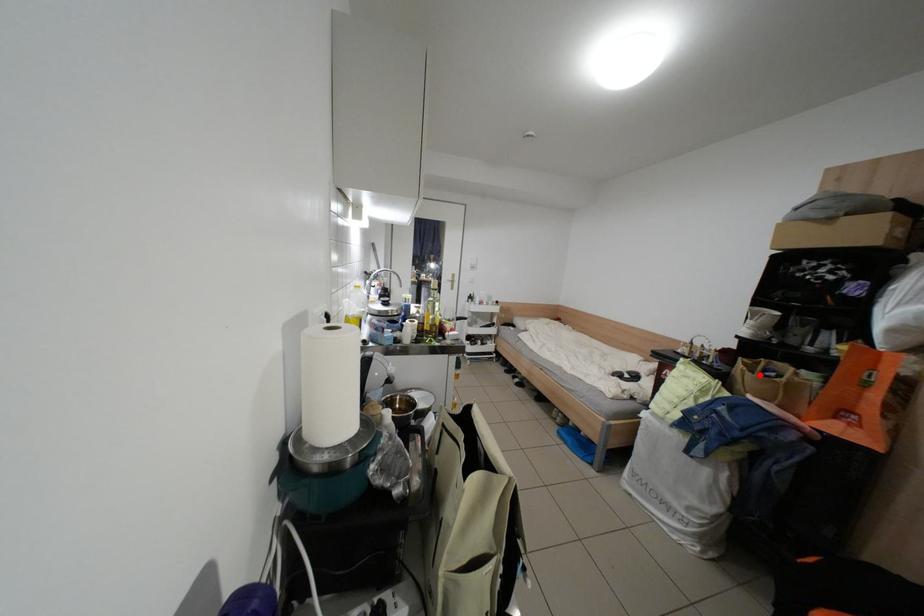
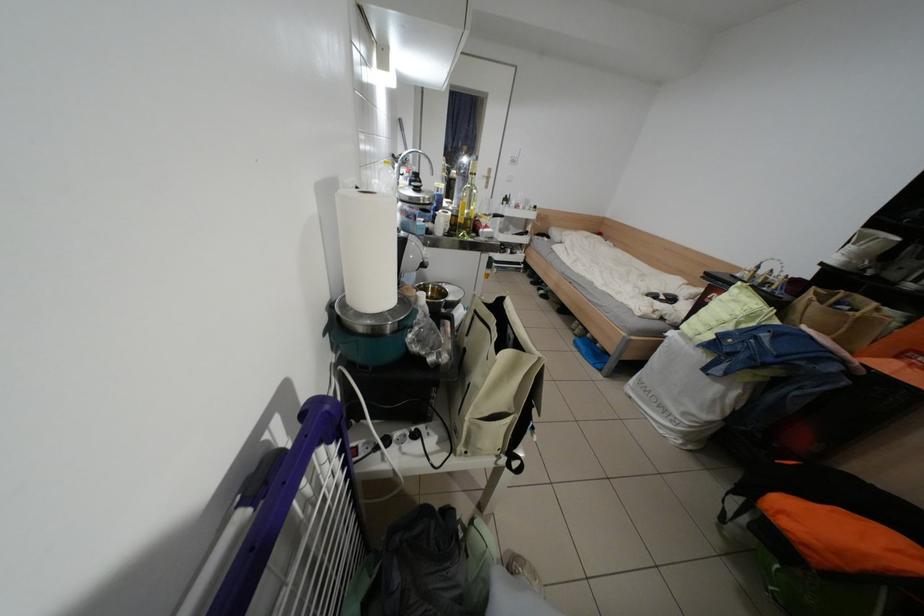
Find the pixel in the second image that matches the highlighted location in the first image.

(827, 305)